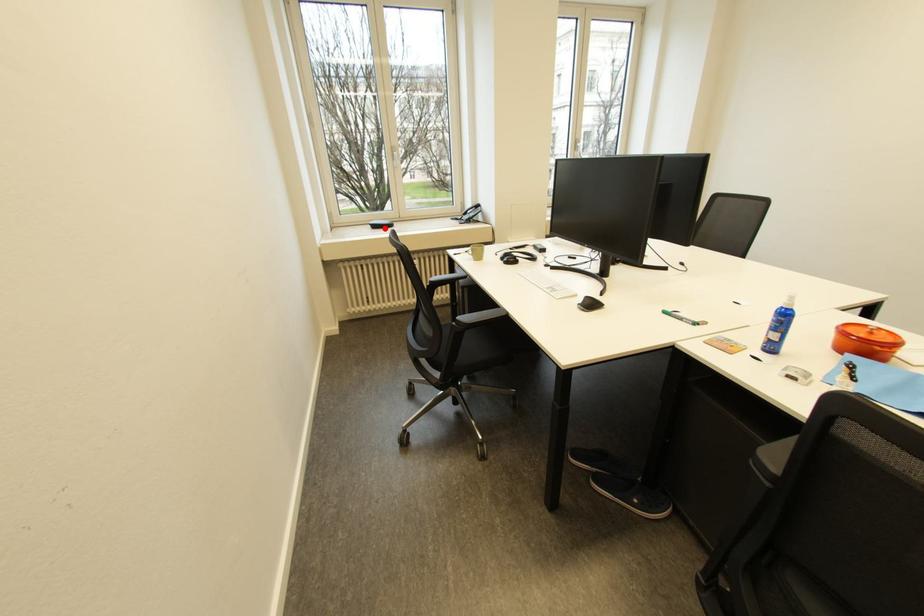
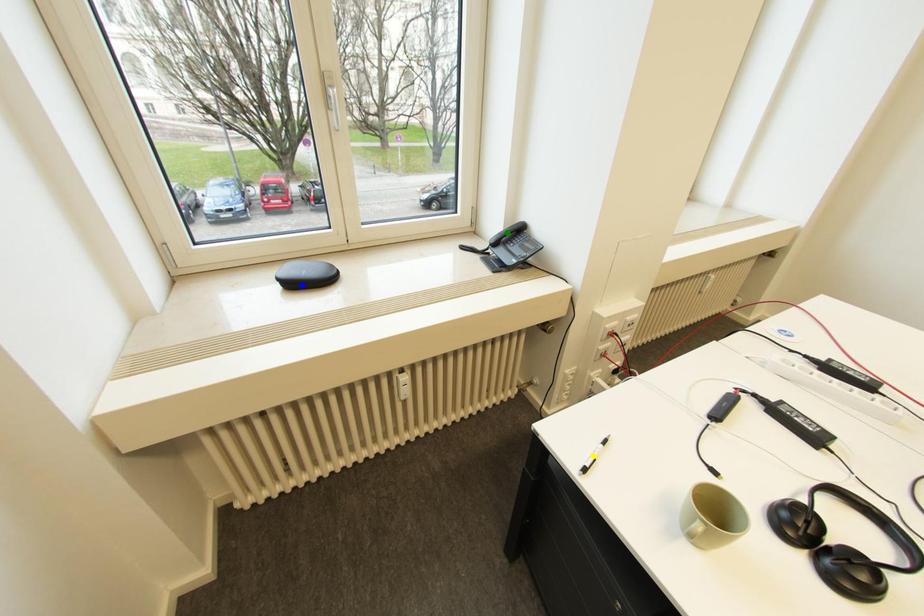
Question: I am providing you with two images of the same scene from different viewpoints. A red point is marked on the first image. You are given multiple points on the second image. Which point in image 2 is actually the same real-world point as the red point in image 1?

Choices:
 (A) green point
 (B) blue point
 (C) yellow point

Answer: (B)